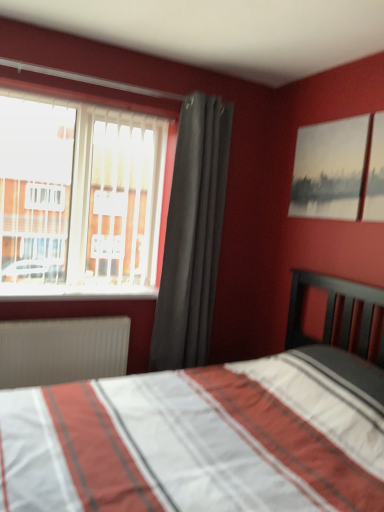
Question: Is gray ribbed radiator at lower left facing towards dark gray fabric curtain at center?

Choices:
 (A) no
 (B) yes

Answer: (A)

Question: Would you consider gray ribbed radiator at lower left to be distant from dark gray fabric curtain at center?

Choices:
 (A) no
 (B) yes

Answer: (A)

Question: Is gray ribbed radiator at lower left positioned in front of dark gray fabric curtain at center?

Choices:
 (A) no
 (B) yes

Answer: (B)

Question: Does gray ribbed radiator at lower left have a lesser width compared to dark gray fabric curtain at center?

Choices:
 (A) yes
 (B) no

Answer: (A)

Question: Can you confirm if gray ribbed radiator at lower left is taller than dark gray fabric curtain at center?

Choices:
 (A) yes
 (B) no

Answer: (B)

Question: From a real-world perspective, relative to gray ribbed radiator at lower left, is transparent glass window at upper left vertically above or below?

Choices:
 (A) above
 (B) below

Answer: (A)

Question: Relative to gray ribbed radiator at lower left, is transparent glass window at upper left in front or behind?

Choices:
 (A) behind
 (B) front

Answer: (B)

Question: Based on their positions, is transparent glass window at upper left located to the left or right of gray ribbed radiator at lower left?

Choices:
 (A) left
 (B) right

Answer: (B)

Question: Is transparent glass window at upper left inside or outside of gray ribbed radiator at lower left?

Choices:
 (A) inside
 (B) outside

Answer: (B)

Question: Is point (26, 365) positioned closer to the camera than point (44, 254)?

Choices:
 (A) farther
 (B) closer

Answer: (B)

Question: Looking at their shapes, would you say gray ribbed radiator at lower left is wider or thinner than transparent glass window at upper left?

Choices:
 (A) wide
 (B) thin

Answer: (B)

Question: Based on their sizes in the image, would you say gray ribbed radiator at lower left is bigger or smaller than transparent glass window at upper left?

Choices:
 (A) small
 (B) big

Answer: (A)

Question: From a real-world perspective, is gray ribbed radiator at lower left above or below transparent glass window at upper left?

Choices:
 (A) below
 (B) above

Answer: (A)

Question: Is dark gray fabric curtain at center taller or shorter than white plastic window sill at left?

Choices:
 (A) tall
 (B) short

Answer: (A)

Question: From the image's perspective, is dark gray fabric curtain at center located above or below white plastic window sill at left?

Choices:
 (A) below
 (B) above

Answer: (B)